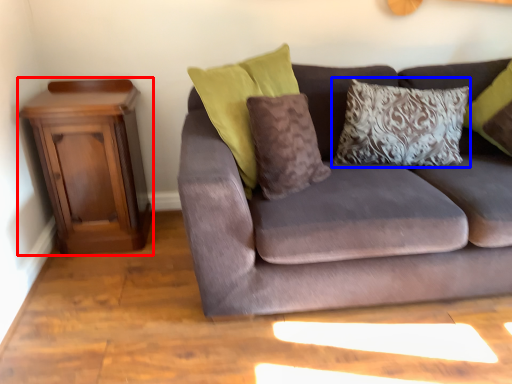
Question: Which object is closer to the camera taking this photo, nightstand (highlighted by a red box) or pillow (highlighted by a blue box)?

Choices:
 (A) nightstand
 (B) pillow

Answer: (A)